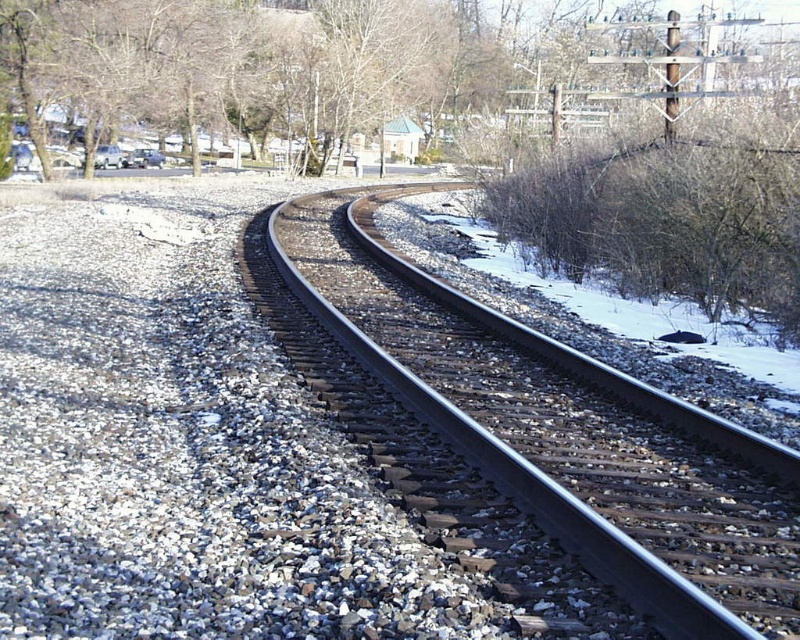
Question: Which point is closer to the camera?

Choices:
 (A) brown leafless tree at upper left
 (B) metal/wooden track at center

Answer: (B)

Question: Can you confirm if metal/wooden track at center is thinner than brown leafless tree at upper left?

Choices:
 (A) yes
 (B) no

Answer: (A)

Question: Can you confirm if metal/wooden track at center is positioned to the left of brown leafless tree at upper left?

Choices:
 (A) no
 (B) yes

Answer: (A)

Question: Which of the following is the closest to the observer?

Choices:
 (A) metal/wooden track at center
 (B) brown leafless tree at upper left

Answer: (A)

Question: Can you confirm if metal/wooden track at center is positioned below brown leafless tree at upper left?

Choices:
 (A) no
 (B) yes

Answer: (B)